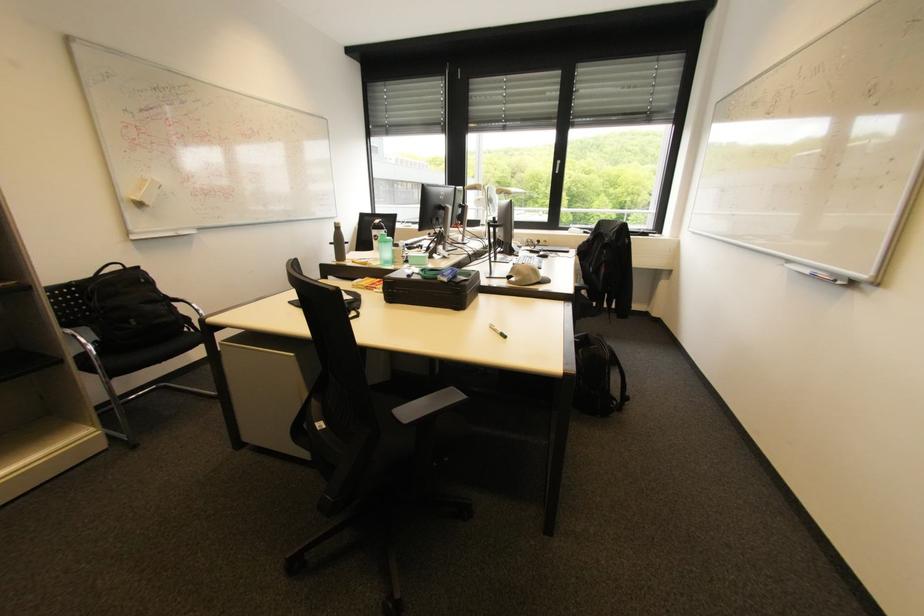
What do you see at coordinates (82, 345) in the screenshot?
I see `a metal chair armrest` at bounding box center [82, 345].